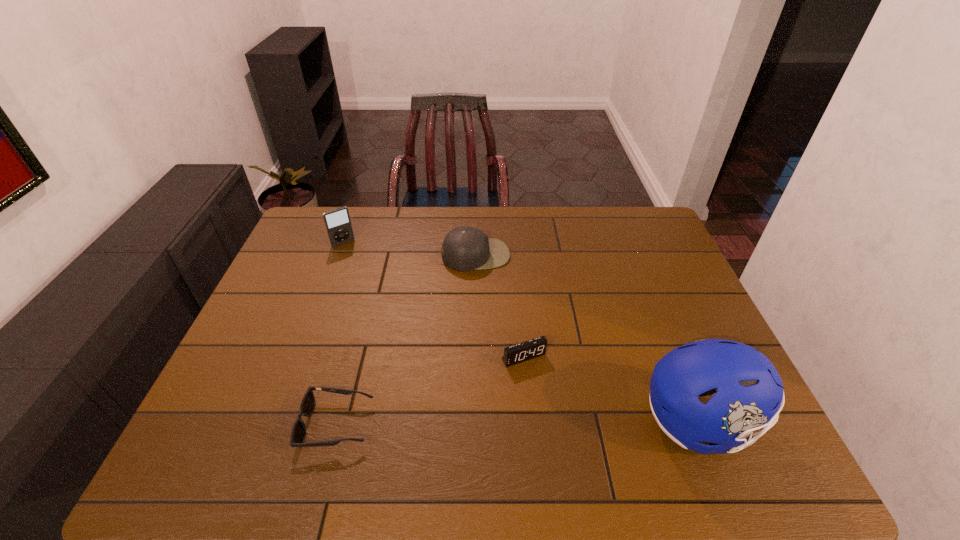
At what (x,y) coordinates should I click in order to perform the action: click on vacant space on the desktop that is between the shortest object and the rightmost object and is positioned on the front-facing side of the second tallest object. Please return your answer as a coordinate pair (x, y). Image resolution: width=960 pixels, height=540 pixels. Looking at the image, I should click on (468, 423).

Where is `free space on the desktop that is between the sunglasses and the football helmet and is positioned on the brim of the third shortest object`? The width and height of the screenshot is (960, 540). free space on the desktop that is between the sunglasses and the football helmet and is positioned on the brim of the third shortest object is located at coordinates (534, 423).

In order to click on vacant space on the desktop that is between the sunglasses and the tallest object and is positioned on the front-facing side of the third nearest object in this screenshot , I will do `click(563, 423)`.